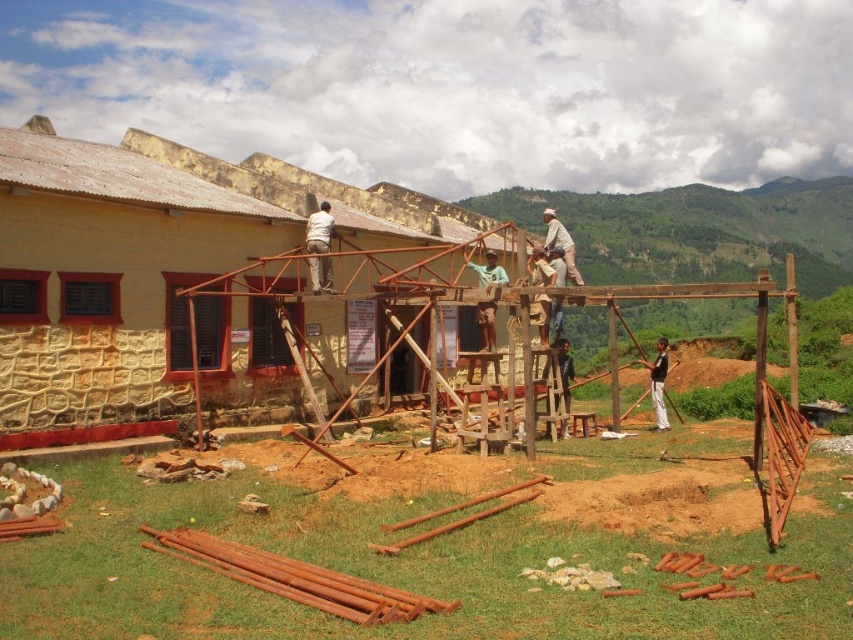
Question: Considering the relative positions of blue fabric shirt at center and dark blue jeans at center in the image provided, where is blue fabric shirt at center located with respect to dark blue jeans at center?

Choices:
 (A) left
 (B) right

Answer: (A)

Question: Estimate the real-world distances between objects in this image. Which object is closer to the light brown fabric shirt at upper center?

Choices:
 (A) yellow matte building at center
 (B) light brown wooden pole at upper center
 (C) blue fabric shirt at center
 (D) dark blue jeans at center

Answer: (A)

Question: From the image, what is the correct spatial relationship of black cotton shirt at center in relation to dark blue jeans at center?

Choices:
 (A) left
 (B) right

Answer: (B)

Question: Does light brown wooden pole at upper center lie in front of black cotton shirt at center?

Choices:
 (A) no
 (B) yes

Answer: (B)

Question: Which object is the farthest from the yellow matte building at center?

Choices:
 (A) light brown fabric shirt at upper center
 (B) light brown wooden pole at upper center
 (C) black cotton shirt at center

Answer: (C)

Question: Based on their relative distances, which object is farther from the blue fabric shirt at center?

Choices:
 (A) dark blue jeans at center
 (B) light brown wooden pole at upper center

Answer: (B)